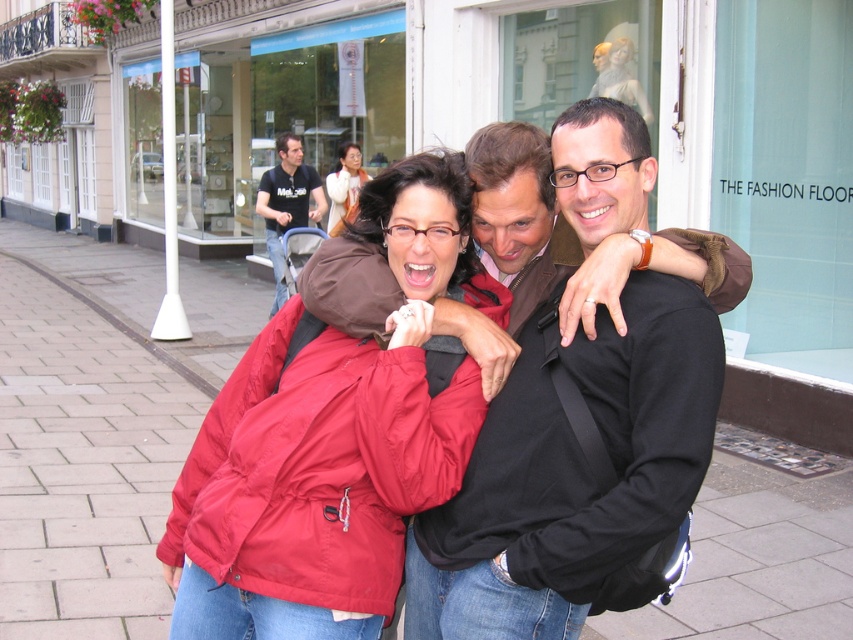
Consider the image. Does paved stone sidewalk at center appear under black cotton shirt at upper left?

Indeed, paved stone sidewalk at center is positioned under black cotton shirt at upper left.

How far apart are paved stone sidewalk at center and black cotton shirt at upper left?

The distance of paved stone sidewalk at center from black cotton shirt at upper left is 1.78 meters.

The width and height of the screenshot is (853, 640). What do you see at coordinates (99, 424) in the screenshot?
I see `paved stone sidewalk at center` at bounding box center [99, 424].

Identify the location of paved stone sidewalk at center. Image resolution: width=853 pixels, height=640 pixels. (99, 424).

Does matte red jacket at center have a smaller size compared to black cotton shirt at upper left?

Indeed, matte red jacket at center has a smaller size compared to black cotton shirt at upper left.

Who is shorter, matte red jacket at center or black cotton shirt at upper left?

matte red jacket at center

Between point (289, 616) and point (293, 154), which one is positioned in front?

Point (289, 616)

Where is `matte red jacket at center`? matte red jacket at center is located at coordinates (332, 442).

This screenshot has height=640, width=853. What do you see at coordinates (572, 474) in the screenshot? I see `matte black jacket at center` at bounding box center [572, 474].

Is matte black jacket at center to the left of black cotton shirt at upper left from the viewer's perspective?

In fact, matte black jacket at center is to the right of black cotton shirt at upper left.

Is point (601, 225) farther from viewer compared to point (291, 179)?

No, it is in front of (291, 179).

Locate an element on the screen. This screenshot has width=853, height=640. matte black jacket at center is located at coordinates (572, 474).